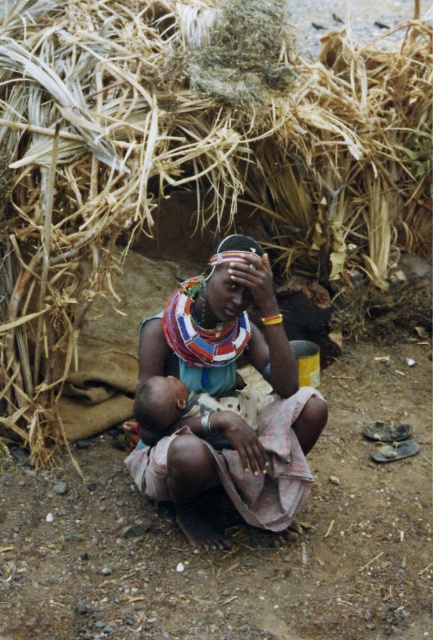
Looking at this image, is multicolored fabric at center below light brown skin child at center?

No.

Who is lower down, multicolored fabric at center or light brown skin child at center?

light brown skin child at center

Between point (312, 444) and point (187, 472), which one is positioned in front?

Point (187, 472) is more forward.

What are the coordinates of `multicolored fabric at center` in the screenshot? It's located at [225, 397].

Based on the photo, between brown straw at upper center and light brown skin child at center, which one is positioned higher?

brown straw at upper center

Identify the location of brown straw at upper center. click(x=190, y=157).

You are a GUI agent. You are given a task and a screenshot of the screen. Output one action in this format:
    pyautogui.click(x=<x>, y=<y>)
    Task: Click on the brown straw at upper center
    Image resolution: width=433 pixels, height=640 pixels.
    Given the screenshot: What is the action you would take?
    pyautogui.click(x=190, y=157)

From the picture: Is brown straw at upper center to the right of multicolored fabric at center from the viewer's perspective?

In fact, brown straw at upper center is to the left of multicolored fabric at center.

Find the location of a particular element. The width and height of the screenshot is (433, 640). brown straw at upper center is located at coordinates (190, 157).